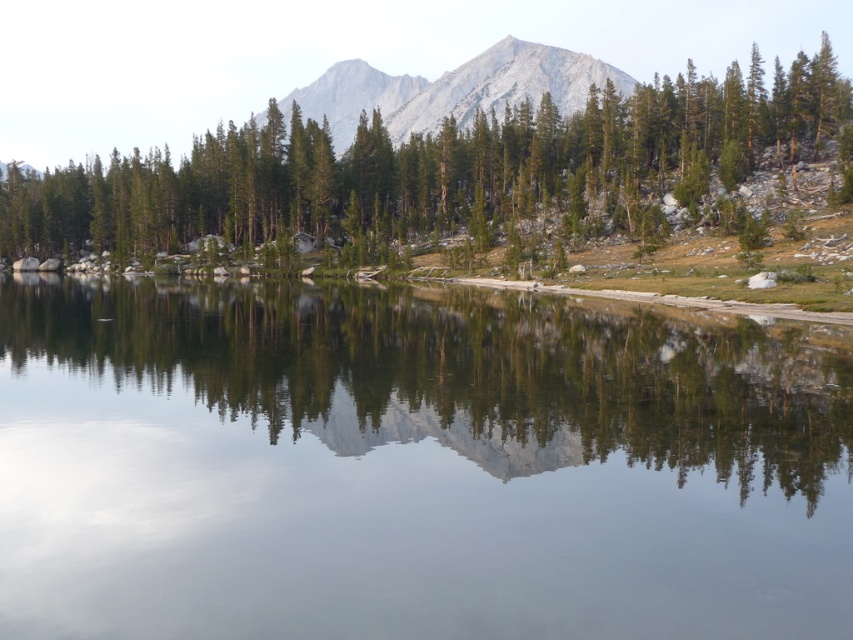
Which is behind, point (566, 509) or point (587, 67)?

The point (587, 67) is behind.

Where is `smooth reflective water at center`? Image resolution: width=853 pixels, height=640 pixels. smooth reflective water at center is located at coordinates (413, 465).

Does green matte tree at center appear on the left side of gray rocky mountain at center?

In fact, green matte tree at center is to the right of gray rocky mountain at center.

Does point (325, 176) come farther from viewer compared to point (410, 116)?

No, it is in front of (410, 116).

This screenshot has width=853, height=640. Find the location of `green matte tree at center`. green matte tree at center is located at coordinates (432, 166).

This screenshot has height=640, width=853. Find the location of `green matte tree at center`. green matte tree at center is located at coordinates (432, 166).

Between smooth reflective water at center and green matte tree at center, which one has less height?

Standing shorter between the two is smooth reflective water at center.

Between smooth reflective water at center and green matte tree at center, which one has more height?

green matte tree at center is taller.

Where is `smooth reflective water at center`? The width and height of the screenshot is (853, 640). smooth reflective water at center is located at coordinates (413, 465).